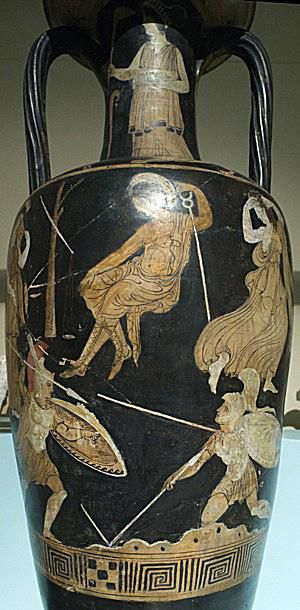
Find the location of a particular element. This screenshot has width=300, height=610. background wall is located at coordinates (287, 545), (291, 501), (11, 528), (11, 565), (12, 167), (75, 108), (213, 112), (283, 87).